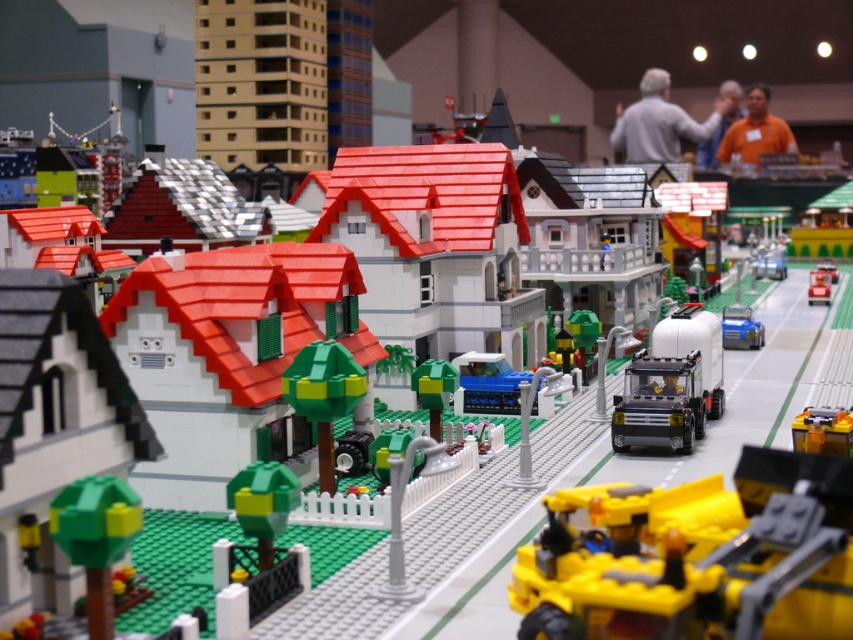
Question: Is metallic silver tanker truck at center-right positioned behind metallic silver car at center?

Choices:
 (A) yes
 (B) no

Answer: (B)

Question: Which is nearer to the metallic silver tanker truck at center-right?

Choices:
 (A) blue plastic truck at center
 (B) smooth white house at center
 (C) metallic silver car at center

Answer: (A)

Question: Which of the following is the farthest from the observer?

Choices:
 (A) (166, 388)
 (B) (490, 401)
 (C) (814, 284)

Answer: (C)

Question: Which point is farther to the camera?

Choices:
 (A) metallic silver car at center
 (B) metallic silver tanker truck at center-right
 (C) smooth white house at center
 (D) yellow plastic truck at center

Answer: (A)

Question: Can you confirm if blue plastic truck at center is bigger than yellow plastic truck at center?

Choices:
 (A) no
 (B) yes

Answer: (B)

Question: Does yellow plastic truck at center have a larger size compared to metallic silver car at center?

Choices:
 (A) yes
 (B) no

Answer: (B)